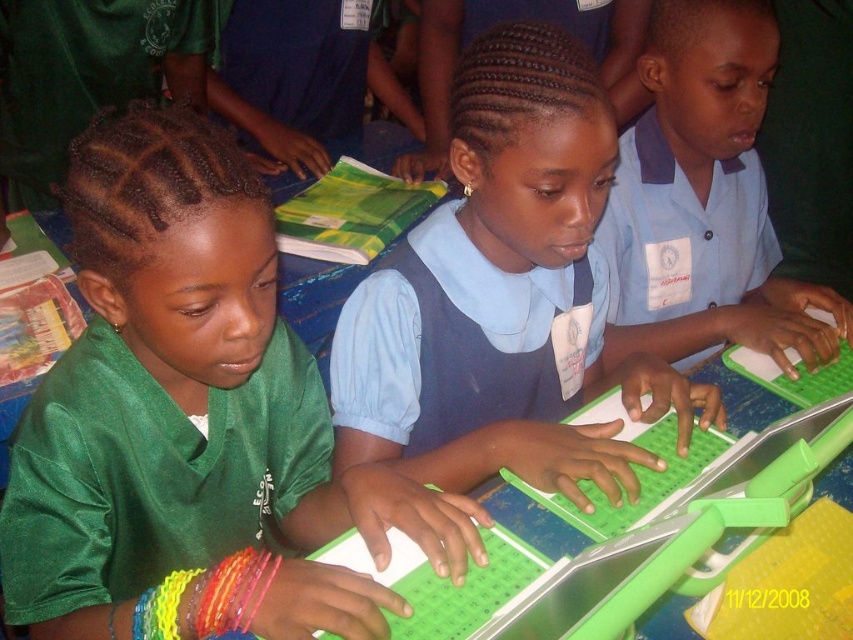
Question: Which point is closer to the camera?

Choices:
 (A) blue fabric shirt at center
 (B) green plastic laptop at center

Answer: (B)

Question: Does green shiny shirt at left come in front of blue fabric shirt at center?

Choices:
 (A) no
 (B) yes

Answer: (B)

Question: Does blue fabric shirt at center appear over green plastic laptop at center?

Choices:
 (A) yes
 (B) no

Answer: (A)

Question: Can you confirm if green shiny shirt at left is thinner than blue fabric shirt at center?

Choices:
 (A) no
 (B) yes

Answer: (B)

Question: Among these points, which one is nearest to the camera?

Choices:
 (A) (405, 285)
 (B) (263, 595)
 (C) (500, 532)

Answer: (B)

Question: Which point is farther from the camera taking this photo?

Choices:
 (A) (704, 545)
 (B) (260, 234)

Answer: (B)